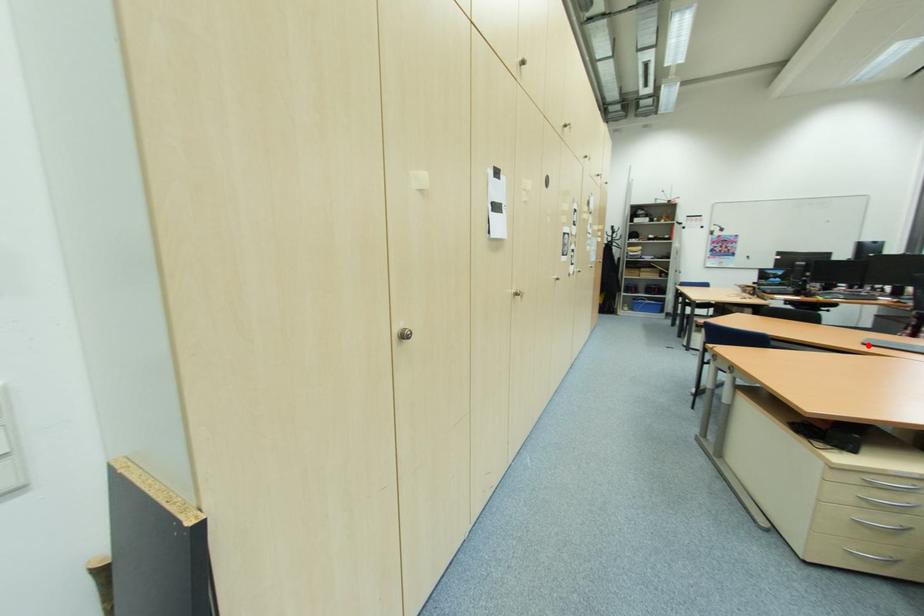
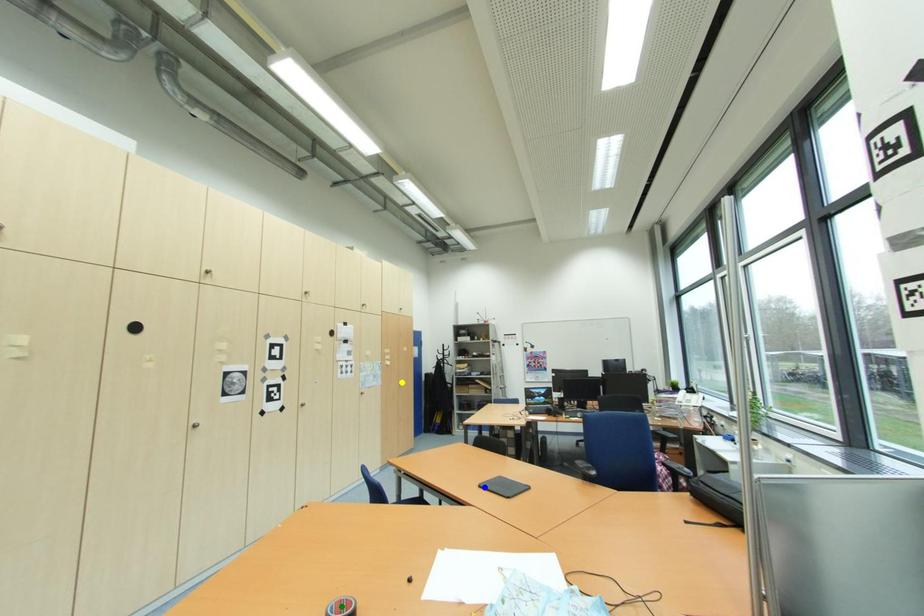
Question: I am providing you with two images of the same scene from different viewpoints. A red point is marked on the first image. You are given multiple points on the second image. Which spot in image 2 lines up with the point in image 1?

Choices:
 (A) blue point
 (B) yellow point
 (C) green point

Answer: (A)